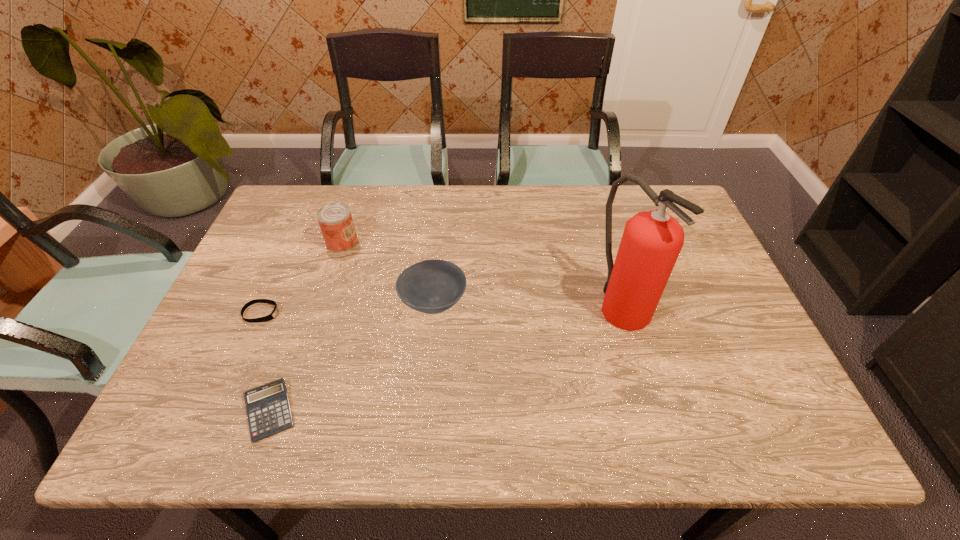
This screenshot has height=540, width=960. I want to click on free space at the right edge, so click(728, 380).

The height and width of the screenshot is (540, 960). What are the coordinates of `unoccupied position between the can and the calculator` in the screenshot? It's located at (306, 327).

At what (x,y) coordinates should I click in order to perform the action: click on empty location between the fire extinguisher and the second object from right to left. Please return your answer as a coordinate pair (x, y). The image size is (960, 540). Looking at the image, I should click on (527, 302).

At what (x,y) coordinates should I click in order to perform the action: click on empty space that is in between the tallest object and the second object from right to left. Please return your answer as a coordinate pair (x, y). Looking at the image, I should click on (527, 302).

Locate an element on the screen. The width and height of the screenshot is (960, 540). blank region between the calculator and the bowl is located at coordinates (351, 357).

The image size is (960, 540). I want to click on free space between the bowl and the leftmost object, so click(348, 308).

Where is `free space between the can and the bowl`? This screenshot has width=960, height=540. free space between the can and the bowl is located at coordinates (388, 272).

Find the location of a particular element. free space between the wristband and the bowl is located at coordinates (348, 308).

Where is `vacant area between the leftmost object and the fourth object from left to right`? vacant area between the leftmost object and the fourth object from left to right is located at coordinates (348, 308).

I want to click on empty space between the wristband and the bowl, so click(x=348, y=308).